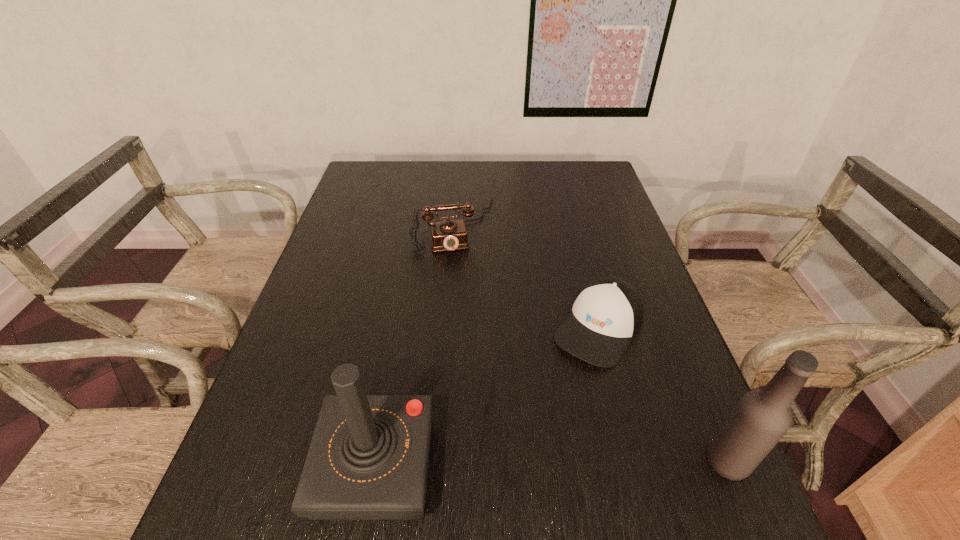
Locate an element on the screen. This screenshot has height=540, width=960. free space located on the dial of the telephone is located at coordinates (473, 328).

Locate an element on the screen. vacant region located on the dial of the telephone is located at coordinates (471, 316).

The height and width of the screenshot is (540, 960). In order to click on vacant space located 0.160m on the dial of the telephone in this screenshot , I will do `click(468, 296)`.

At what (x,y) coordinates should I click in order to perform the action: click on joystick present at the near edge. Please return your answer as a coordinate pair (x, y). The width and height of the screenshot is (960, 540). Looking at the image, I should click on (368, 459).

I want to click on beer bottle that is at the near edge, so click(x=759, y=420).

You are a GUI agent. You are given a task and a screenshot of the screen. Output one action in this format:
    pyautogui.click(x=<x>, y=<y>)
    Task: Click on the object that is positioned at the left edge
    The image size is (960, 540).
    Given the screenshot: What is the action you would take?
    tap(368, 459)

At what (x,y) coordinates should I click in order to perform the action: click on beer bottle that is at the right edge. Please return your answer as a coordinate pair (x, y). This screenshot has width=960, height=540. Looking at the image, I should click on (759, 420).

Identify the location of cap that is at the right edge. The height and width of the screenshot is (540, 960). tap(607, 314).

Identify the location of object situated at the near left corner. The image size is (960, 540). (368, 459).

Image resolution: width=960 pixels, height=540 pixels. Find the location of `object at the near right corner`. object at the near right corner is located at coordinates (759, 420).